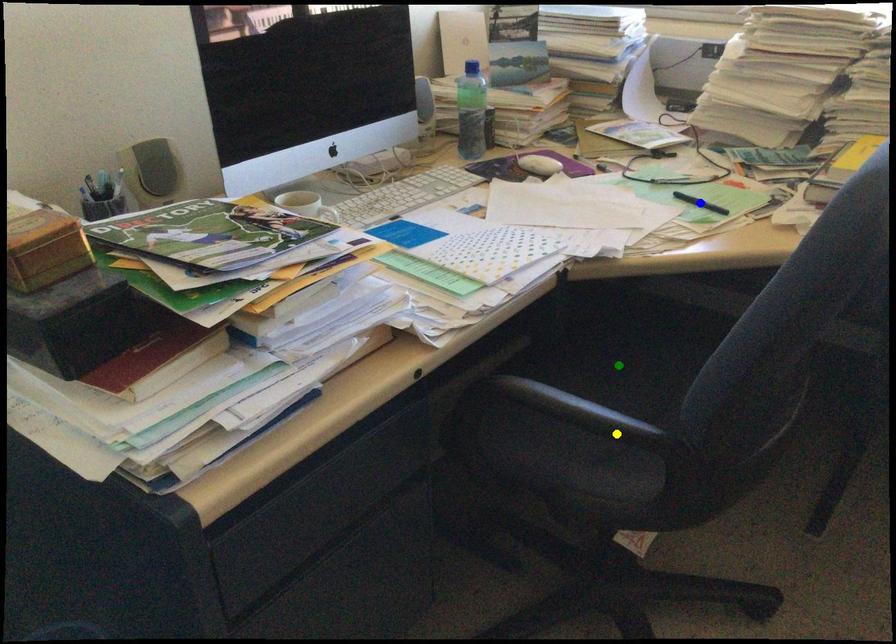
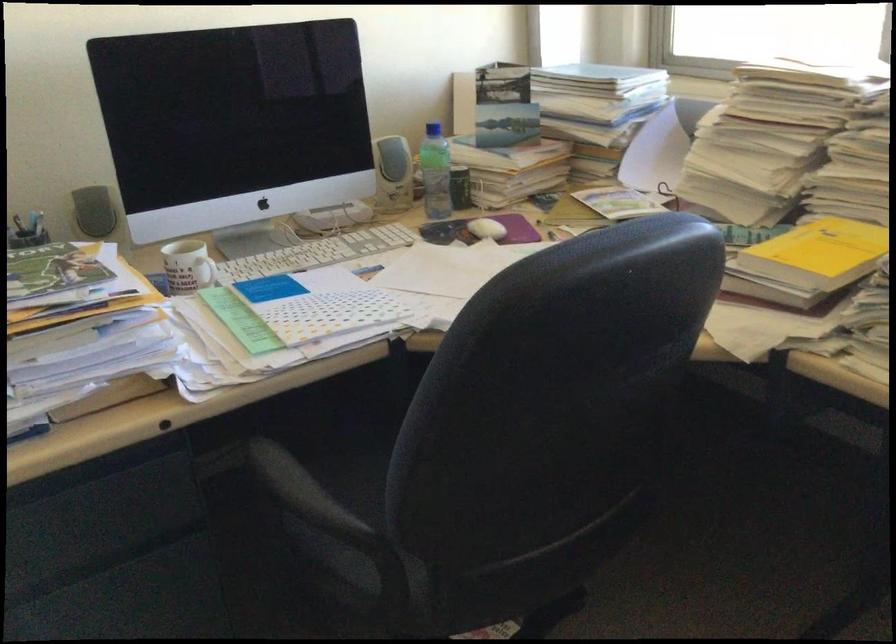
I am providing you with two images of the same scene from different viewpoints. Three points are marked in image1. Which point corresponds to a part or object that is occluded in image2?In image1, three points are marked. Which of them correspond to a part or object that is occluded in image2?Among the three points shown in image1, which one corresponds to a part or object that is no longer visible due to occlusion in image2?

Invisible in image2: green point, blue point.